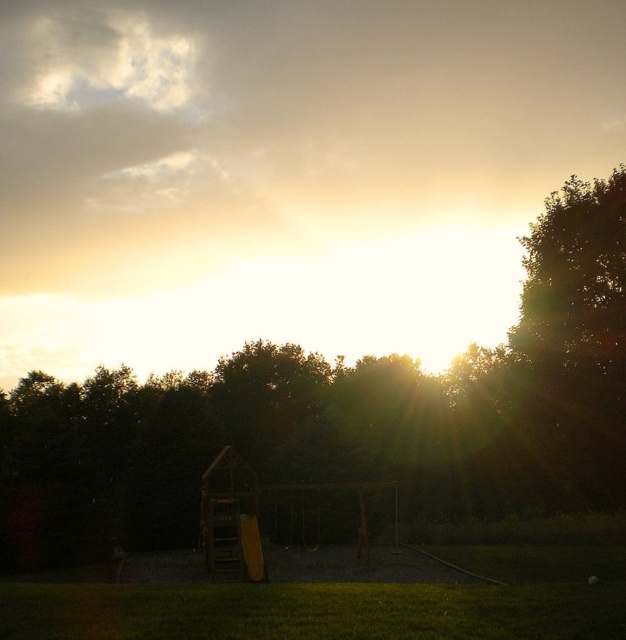
Question: Is dark green leafy tree at center smaller than wooden swing at center?

Choices:
 (A) no
 (B) yes

Answer: (A)

Question: Does dark green leafy tree at center appear on the left side of wooden swing at center?

Choices:
 (A) yes
 (B) no

Answer: (B)

Question: Which of the following is the closest to the observer?

Choices:
 (A) pyautogui.click(x=563, y=451)
 (B) pyautogui.click(x=552, y=592)

Answer: (B)

Question: Is wooden slide at center positioned behind wooden swing at center?

Choices:
 (A) yes
 (B) no

Answer: (B)

Question: Estimate the real-world distances between objects in this image. Which object is closer to the dark green leafy tree at center?

Choices:
 (A) green grass at lower center
 (B) wooden slide at center

Answer: (B)

Question: Which object appears farthest from the camera in this image?

Choices:
 (A) wooden swing at center
 (B) wooden slide at center
 (C) green grass at lower center

Answer: (A)